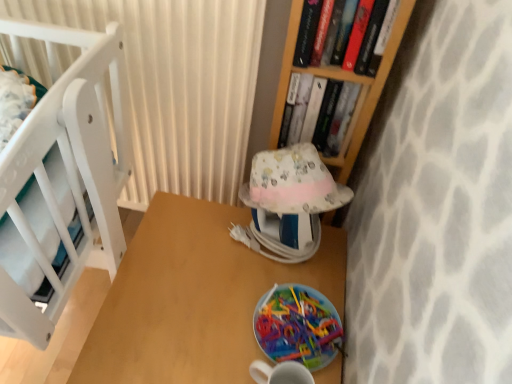
Question: Is wooden table at center to the right of hardcover book at upper center, arranged as the 2th book when viewed from the front, from the viewer's perspective?

Choices:
 (A) no
 (B) yes

Answer: (A)

Question: From the image's perspective, is wooden table at center on hardcover book at upper center, arranged as the 2th book when viewed from the front?

Choices:
 (A) no
 (B) yes

Answer: (A)

Question: Would you say wooden table at center is outside hardcover book at upper center, the first book positioned from the back?

Choices:
 (A) no
 (B) yes

Answer: (B)

Question: Is wooden table at center aimed at hardcover book at upper center, arranged as the 2th book when viewed from the front?

Choices:
 (A) no
 (B) yes

Answer: (A)

Question: Does wooden table at center have a smaller size compared to hardcover book at upper center, arranged as the 2th book when viewed from the front?

Choices:
 (A) no
 (B) yes

Answer: (A)

Question: Are wooden table at center and hardcover book at upper center, arranged as the 2th book when viewed from the front, beside each other?

Choices:
 (A) no
 (B) yes

Answer: (A)

Question: Is wooden table at center beside patterned fabric lampshade at center?

Choices:
 (A) yes
 (B) no

Answer: (B)

Question: From a real-world perspective, is wooden table at center located beneath patterned fabric lampshade at center?

Choices:
 (A) yes
 (B) no

Answer: (A)

Question: Is patterned fabric lampshade at center completely or partially inside wooden table at center?

Choices:
 (A) yes
 (B) no

Answer: (B)

Question: Are wooden table at center and patterned fabric lampshade at center located far from each other?

Choices:
 (A) no
 (B) yes

Answer: (A)

Question: Is wooden table at center wider than patterned fabric lampshade at center?

Choices:
 (A) yes
 (B) no

Answer: (A)

Question: Is wooden table at center shorter than patterned fabric lampshade at center?

Choices:
 (A) yes
 (B) no

Answer: (B)

Question: Is hardcover book at upper right, which appears as the 1th book when viewed from the front, to the left of translucent plastic plate at lower center from the viewer's perspective?

Choices:
 (A) yes
 (B) no

Answer: (B)